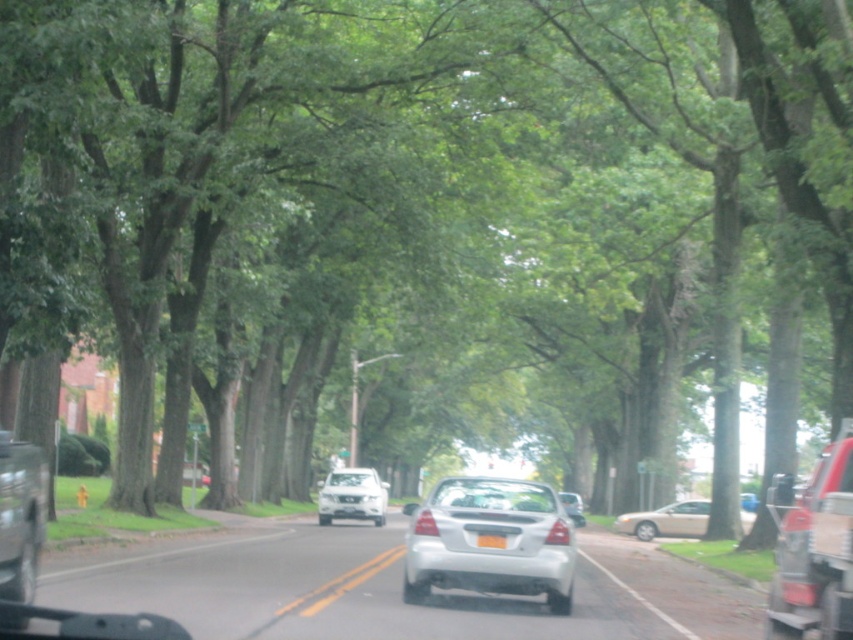
Question: Is yellow solid lines at center bigger than white plastic license plate at center?

Choices:
 (A) no
 (B) yes

Answer: (B)

Question: Is silver metallic sedan at center above yellow solid lines at center?

Choices:
 (A) yes
 (B) no

Answer: (A)

Question: Which object appears closest to the camera in this image?

Choices:
 (A) beige matte sedan at center
 (B) white plastic license plate at center

Answer: (B)

Question: Which object is closer to the camera taking this photo?

Choices:
 (A) white glossy sedan at center
 (B) satin silver sedan at center
 (C) beige matte sedan at center

Answer: (B)

Question: Considering the real-world distances, which object is farthest from the white matte sedan at center?

Choices:
 (A) smooth asphalt road at center
 (B) beige matte sedan at center
 (C) yellow matte license plate at center
 (D) silver metallic sedan at center

Answer: (D)

Question: Can you confirm if metallic red truck at right is wider than yellow solid lines at center?

Choices:
 (A) no
 (B) yes

Answer: (A)